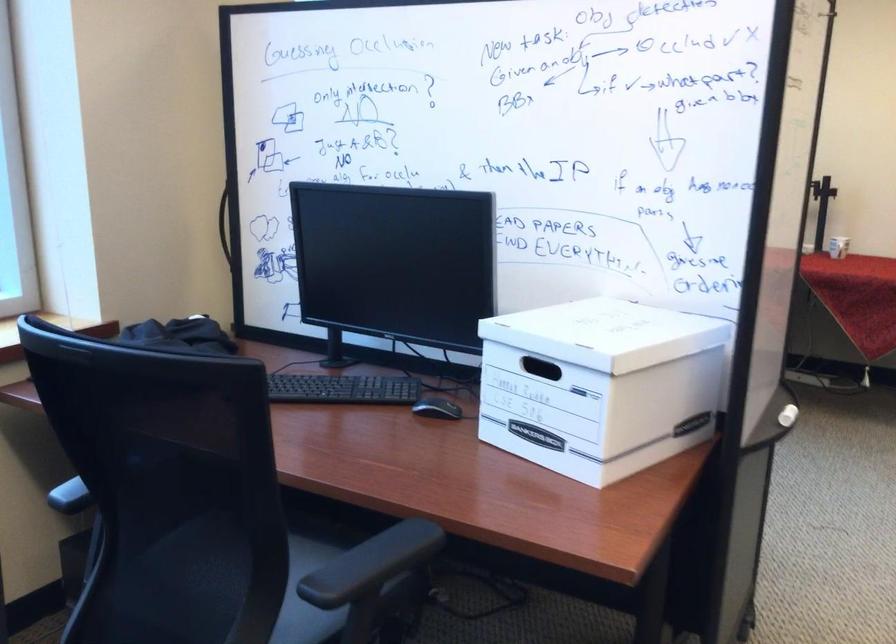
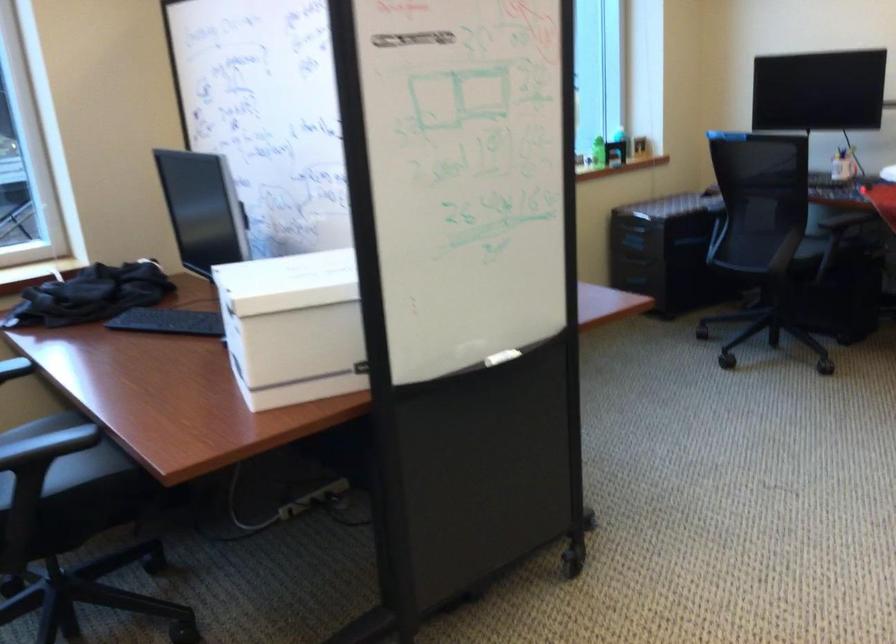
Find the pixel in the second image that matches the point at 640,391 in the first image.

(293, 327)